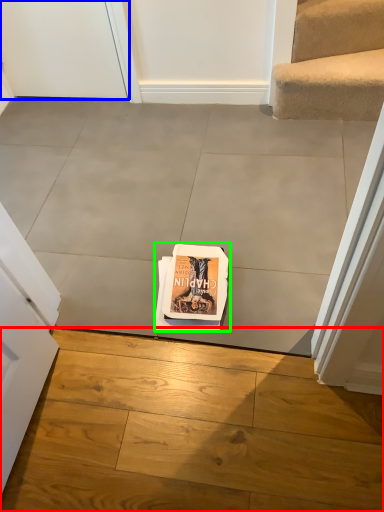
Question: Which object is positioned farthest from concrete (highlighted by a red box)? Select from door (highlighted by a blue box) and paperback book (highlighted by a green box).

Choices:
 (A) door
 (B) paperback book

Answer: (A)